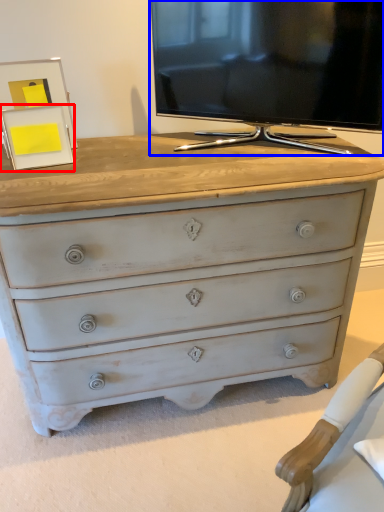
Question: Among these objects, which one is farthest to the camera, picture frame (highlighted by a red box) or television (highlighted by a blue box)?

Choices:
 (A) picture frame
 (B) television

Answer: (A)